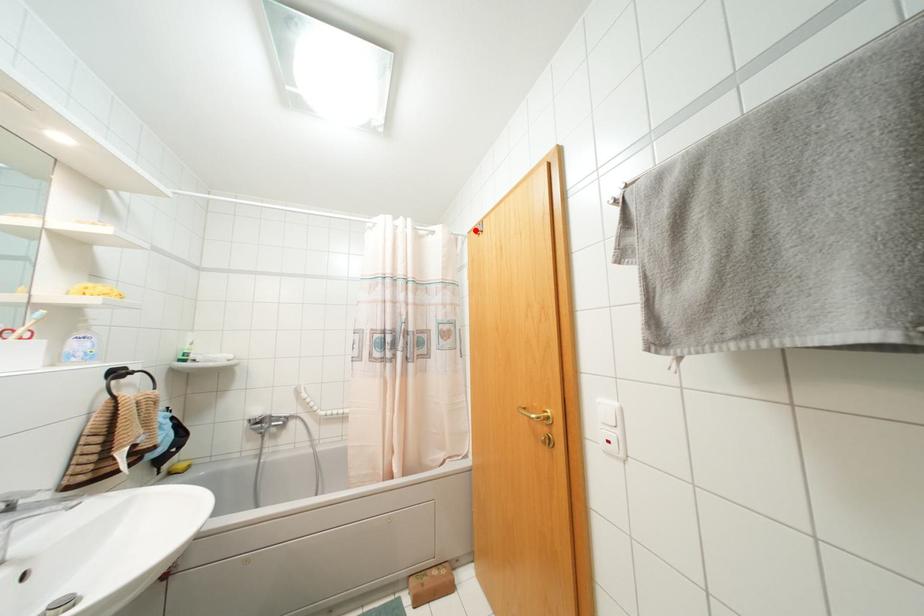
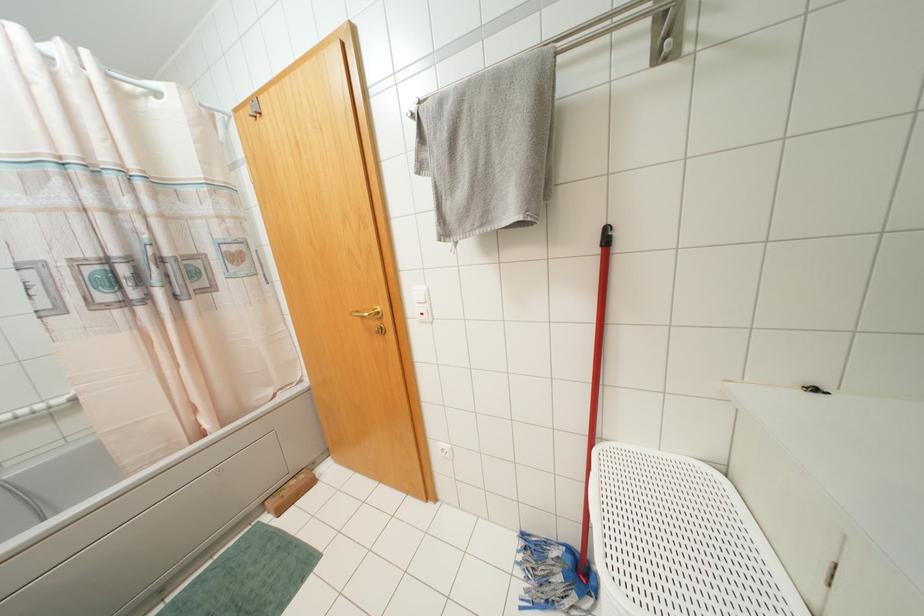
The point at the highlighted location is marked in the first image. Where is the corresponding point in the second image?

(249, 110)